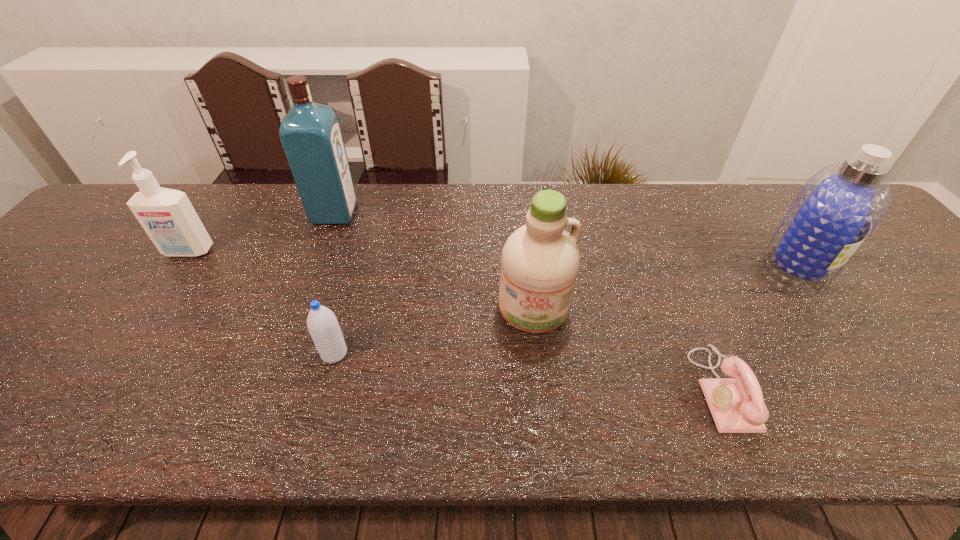
Locate an element on the screen. The height and width of the screenshot is (540, 960). vacant space in between the water bottle and the leftmost cleansing agent is located at coordinates (261, 302).

You are a GUI agent. You are given a task and a screenshot of the screen. Output one action in this format:
    pyautogui.click(x=<x>, y=<y>)
    Task: Click on the vacant area that lies between the water bottle and the shortest object
    This screenshot has width=960, height=540.
    Given the screenshot: What is the action you would take?
    pyautogui.click(x=528, y=372)

Locate which object ranks third in proximity to the second cleansing agent from right to left. Please provide its 2D coordinates. Your answer should be formatted as a tuple, i.e. [(x, y)], where the tuple contains the x and y coordinates of a point satisfying the conditions above.

[(310, 133)]

Locate which object ranks fifth in proximity to the rightmost object. Please provide its 2D coordinates. Your answer should be formatted as a tuple, i.e. [(x, y)], where the tuple contains the x and y coordinates of a point satisfying the conditions above.

[(167, 216)]

The image size is (960, 540). I want to click on cleansing agent that stands as the closest to the leftmost cleansing agent, so (x=540, y=260).

Locate which cleansing agent ranks in proximity to the leftmost object. Please provide its 2D coordinates. Your answer should be formatted as a tuple, i.e. [(x, y)], where the tuple contains the x and y coordinates of a point satisfying the conditions above.

[(540, 260)]

Where is `free space that satisfies the following two spatial constraints: 1. on the back side of the rightmost cleansing agent; 2. on the flat label side of the farthest object`? The image size is (960, 540). free space that satisfies the following two spatial constraints: 1. on the back side of the rightmost cleansing agent; 2. on the flat label side of the farthest object is located at coordinates (755, 213).

Where is `vacant point that satisfies the following two spatial constraints: 1. on the front label of the rightmost object; 2. on the left side of the leftmost object`? This screenshot has height=540, width=960. vacant point that satisfies the following two spatial constraints: 1. on the front label of the rightmost object; 2. on the left side of the leftmost object is located at coordinates (177, 269).

Locate an element on the screen. The width and height of the screenshot is (960, 540). vacant space that satisfies the following two spatial constraints: 1. on the flat label side of the liquor; 2. on the front label of the leftmost object is located at coordinates (321, 252).

The height and width of the screenshot is (540, 960). What are the coordinates of `vacant point that satisfies the following two spatial constraints: 1. on the flat label side of the rightmost object; 2. on the left side of the farthest object` in the screenshot? It's located at pyautogui.click(x=314, y=269).